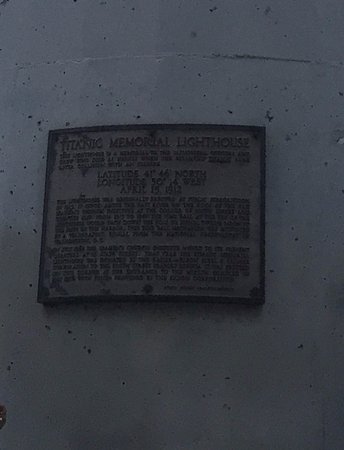
Locate an element on the screen. The image size is (344, 450). black frame around sign in senter is located at coordinates (263, 177), (258, 299), (156, 126), (37, 246), (153, 295).